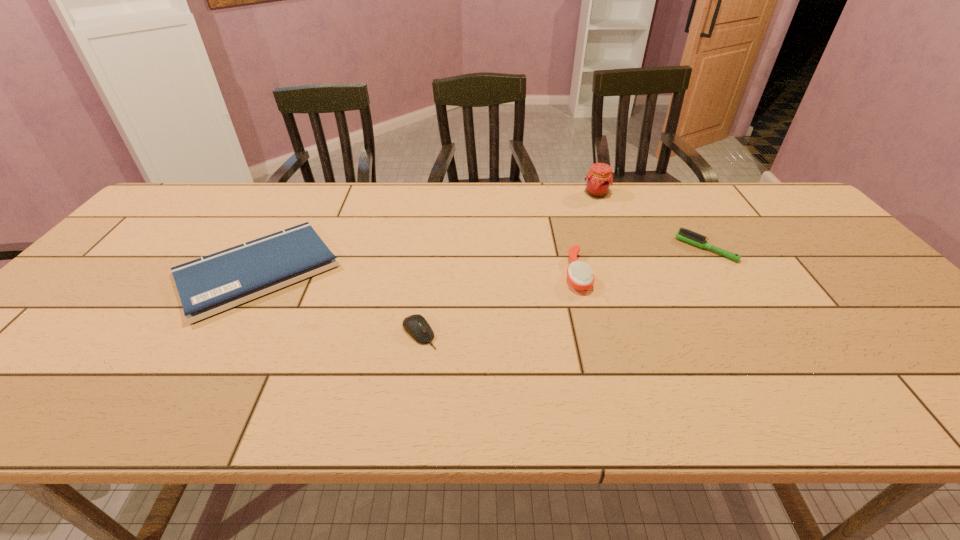
Where is `object that is the second closest one to the paperback book`? object that is the second closest one to the paperback book is located at coordinates (580, 276).

Identify the location of vacant space that satisfies the following two spatial constraints: 1. on the front side of the rightmost object; 2. on the left side of the jam. (617, 249).

This screenshot has width=960, height=540. I want to click on blank area in the image that satisfies the following two spatial constraints: 1. on the back side of the rightmost object; 2. on the left side of the leftmost object, so click(x=271, y=249).